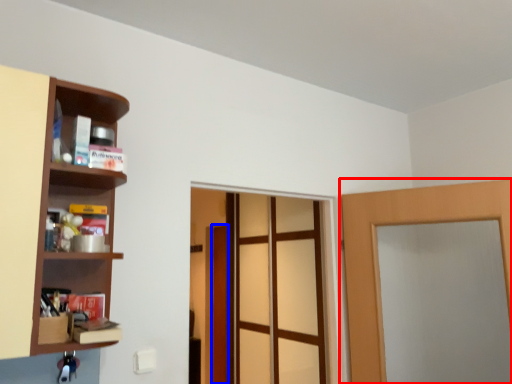
Question: Which point is further to the camera, door (highlighted by a red box) or door (highlighted by a blue box)?

Choices:
 (A) door
 (B) door

Answer: (B)